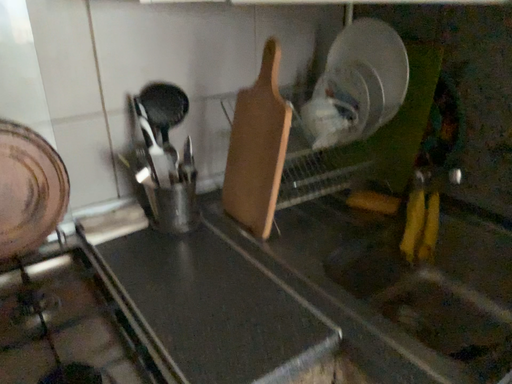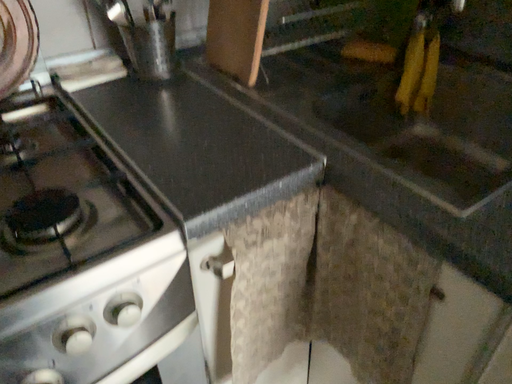
Question: How did the camera likely rotate when shooting the video?

Choices:
 (A) rotated upward
 (B) rotated downward

Answer: (B)